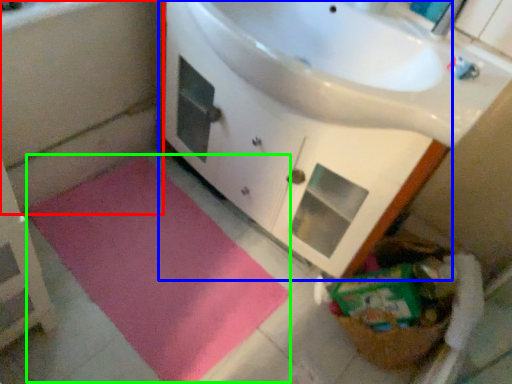
Question: Estimate the real-world distances between objects in this image. Which object is closer to bath (highlighted by a red box), bathroom cabinet (highlighted by a blue box) or bath mat (highlighted by a green box)?

Choices:
 (A) bathroom cabinet
 (B) bath mat

Answer: (B)